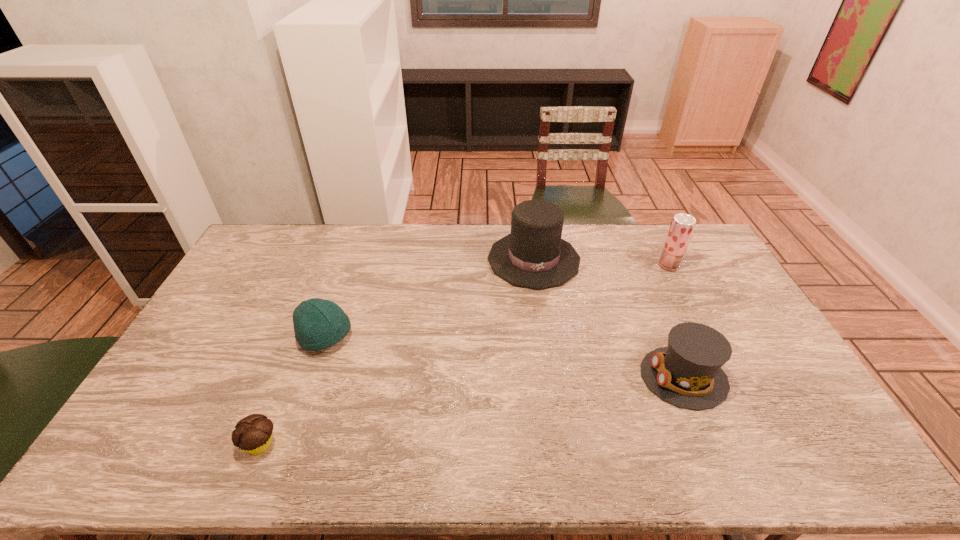
This screenshot has height=540, width=960. I want to click on free point located 0.330m with goggles on the front of the right dress hat, so click(x=523, y=377).

The height and width of the screenshot is (540, 960). I want to click on vacant area situated 0.300m with goggles on the front of the right dress hat, so click(535, 377).

The width and height of the screenshot is (960, 540). I want to click on free spot located 0.390m with goggles on the front of the right dress hat, so click(x=502, y=377).

Find the location of a particular element. vacant space located on the left of the second shortest object is located at coordinates pos(266,337).

Locate an element on the screen. This screenshot has height=540, width=960. vacant position located on the right of the muffin is located at coordinates (331, 444).

Locate an element on the screen. dress hat present at the far edge is located at coordinates (534, 256).

Locate an element on the screen. The image size is (960, 540). fruit juice located at the far edge is located at coordinates point(682,226).

Identify the location of object that is at the near edge. (253, 434).

You are a GUI agent. You are given a task and a screenshot of the screen. Output one action in this format:
    pyautogui.click(x=<x>, y=<y>)
    Task: Click on the object that is at the right edge
    
    Given the screenshot: What is the action you would take?
    pyautogui.click(x=682, y=226)

Locate an element on the screen. object at the far right corner is located at coordinates (682, 226).